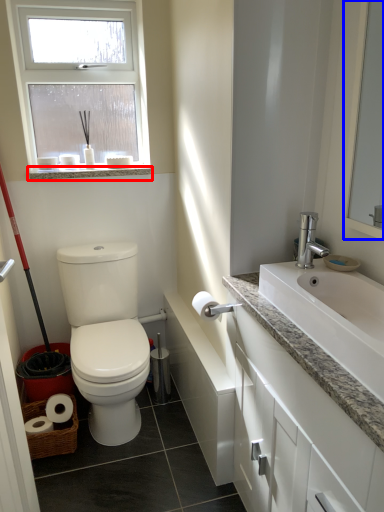
Question: Which object is further to the camera taking this photo, window sill (highlighted by a red box) or mirror (highlighted by a blue box)?

Choices:
 (A) window sill
 (B) mirror

Answer: (A)